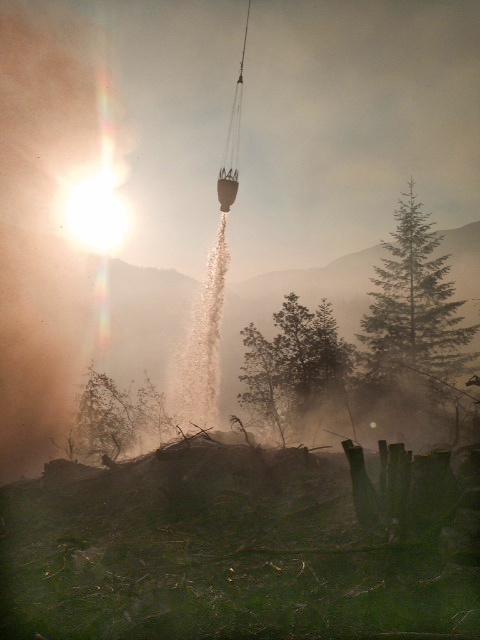
Question: Is green matte tree at center to the right of translucent sand at center from the viewer's perspective?

Choices:
 (A) yes
 (B) no

Answer: (A)

Question: Which object is the farthest from the green matte tree at center?

Choices:
 (A) green textured pine tree at center right
 (B) translucent sand at center

Answer: (B)

Question: Which point is closer to the camera?

Choices:
 (A) translucent sand at center
 (B) green matte tree at center

Answer: (B)

Question: Considering the relative positions of green textured pine tree at center right and green matte tree at center in the image provided, where is green textured pine tree at center right located with respect to green matte tree at center?

Choices:
 (A) right
 (B) left

Answer: (A)

Question: Among these objects, which one is farthest from the camera?

Choices:
 (A) green textured pine tree at center right
 (B) translucent sand at center
 (C) green matte tree at center

Answer: (B)

Question: Does green textured pine tree at center right appear over green matte tree at center?

Choices:
 (A) yes
 (B) no

Answer: (A)